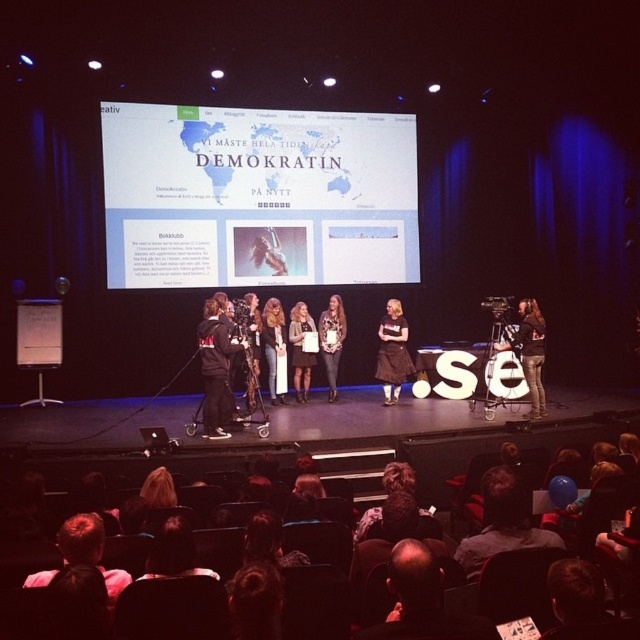
Question: Does brown fabric skirt at center appear under leather jacket at center?

Choices:
 (A) yes
 (B) no

Answer: (A)

Question: Can you confirm if black leather jacket at center is positioned above brown fabric skirt at center?

Choices:
 (A) no
 (B) yes

Answer: (A)

Question: Which point appears closest to the camera in this image?

Choices:
 (A) (272, 316)
 (B) (301, 342)

Answer: (A)

Question: Among these points, which one is nearest to the camera?

Choices:
 (A) (221, 422)
 (B) (291, 355)
 (C) (332, 380)

Answer: (A)

Question: Which of the following is the closest to the observer?

Choices:
 (A) (397, 376)
 (B) (298, 378)
 (C) (376, 180)
 (D) (275, 394)

Answer: (A)

Question: Is black leather jacket at center closer to the viewer compared to brown fabric skirt at center?

Choices:
 (A) no
 (B) yes

Answer: (B)